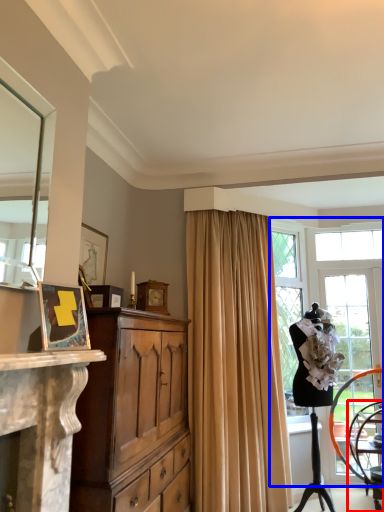
Question: Which of the following is the farthest to the observer, chair (highlighted by a red box) or window (highlighted by a blue box)?

Choices:
 (A) chair
 (B) window

Answer: (A)